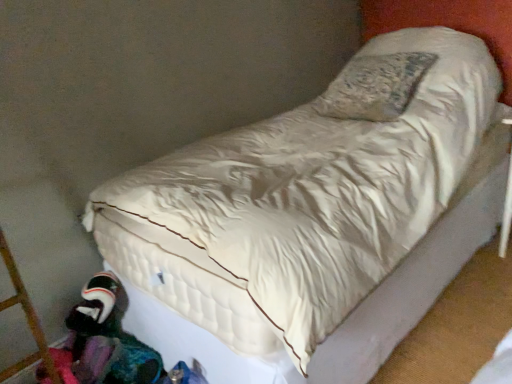
Question: From a real-world perspective, relative to plush fabric toy at lower left, is multicolored fabric at lower left vertically above or below?

Choices:
 (A) above
 (B) below

Answer: (B)

Question: Do you think multicolored fabric at lower left is within plush fabric toy at lower left, or outside of it?

Choices:
 (A) inside
 (B) outside

Answer: (B)

Question: Is point (114, 360) closer or farther from the camera than point (113, 292)?

Choices:
 (A) closer
 (B) farther

Answer: (A)

Question: From a real-world perspective, is plush fabric toy at lower left above or below multicolored fabric at lower left?

Choices:
 (A) above
 (B) below

Answer: (A)

Question: Do you think plush fabric toy at lower left is within multicolored fabric at lower left, or outside of it?

Choices:
 (A) outside
 (B) inside

Answer: (A)

Question: From the image's perspective, is plush fabric toy at lower left positioned above or below multicolored fabric at lower left?

Choices:
 (A) above
 (B) below

Answer: (A)

Question: Considering the positions of plush fabric toy at lower left and multicolored fabric at lower left in the image, is plush fabric toy at lower left taller or shorter than multicolored fabric at lower left?

Choices:
 (A) tall
 (B) short

Answer: (A)